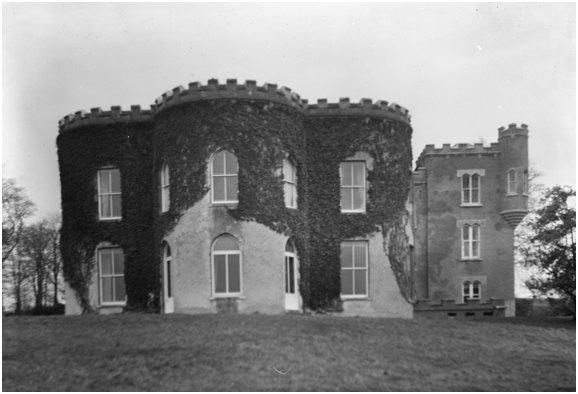
This screenshot has width=578, height=394. In order to click on downstairs window in this screenshot , I will do `click(109, 267)`, `click(166, 278)`, `click(229, 267)`, `click(290, 279)`, `click(349, 268)`, `click(470, 290)`.